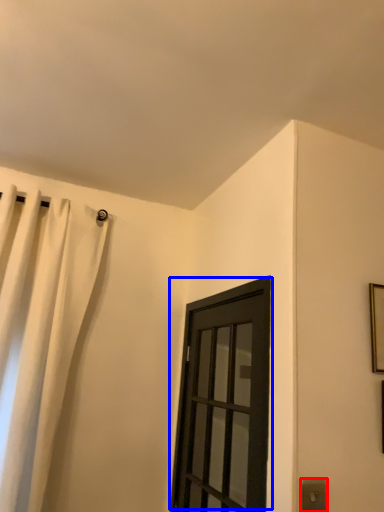
Question: Which point is further to the camera, electric outlet (highlighted by a red box) or door (highlighted by a blue box)?

Choices:
 (A) electric outlet
 (B) door

Answer: (B)